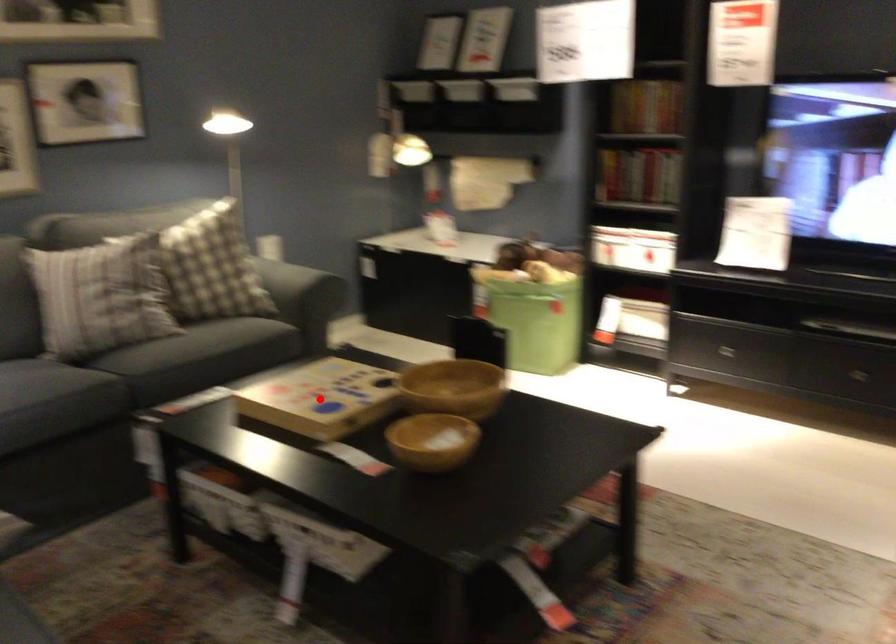
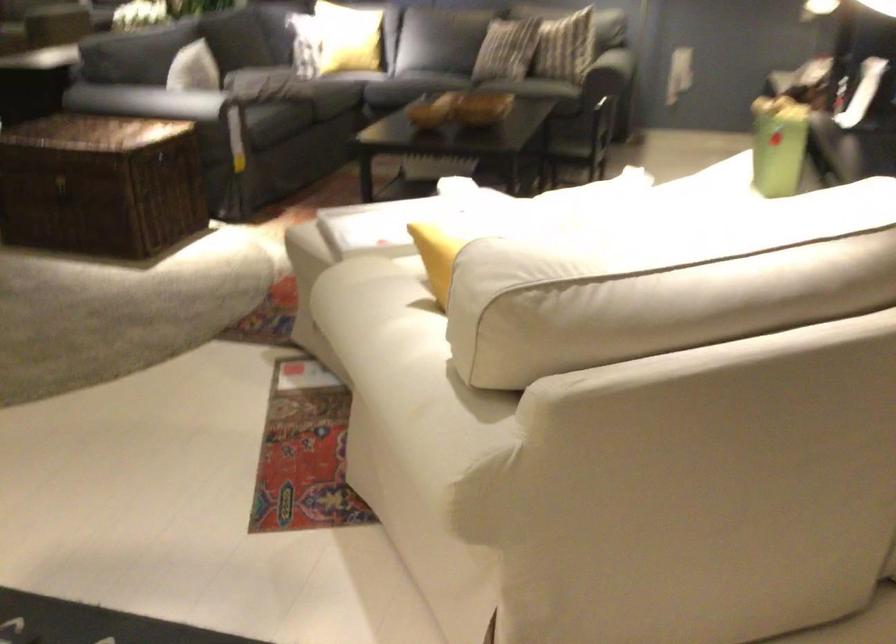
Question: I am providing you with two images of the same scene from different viewpoints. A red point is marked on the first image. Can you still see the location of the red point in image 2?

Choices:
 (A) Yes
 (B) No

Answer: (B)